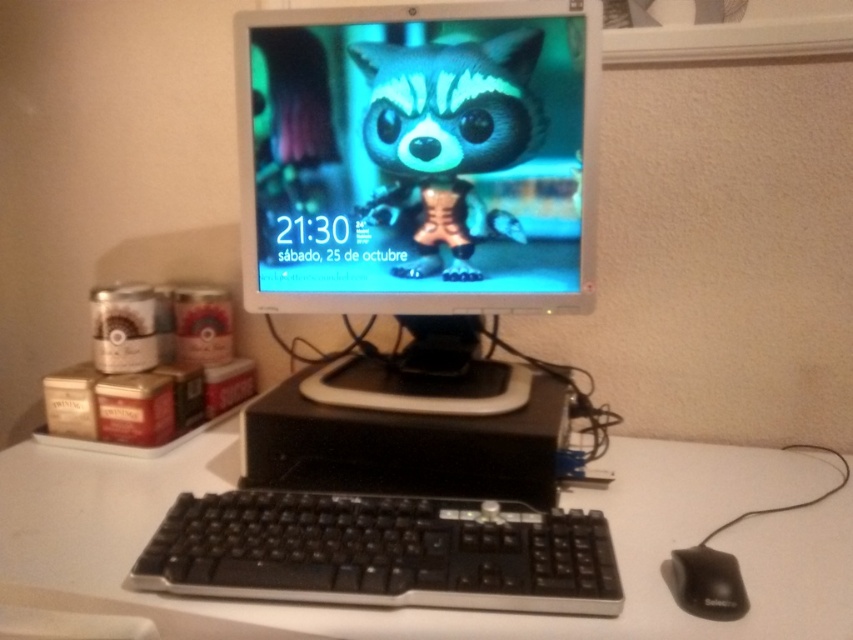
Is black plastic keyboard at center shorter than black matte mouse at lower right?

No.

Which is more to the right, black plastic keyboard at center or black matte mouse at lower right?

black matte mouse at lower right is more to the right.

Image resolution: width=853 pixels, height=640 pixels. What do you see at coordinates (381, 552) in the screenshot?
I see `black plastic keyboard at center` at bounding box center [381, 552].

What are the coordinates of `black plastic keyboard at center` in the screenshot? It's located at (381, 552).

Describe the element at coordinates (434, 609) in the screenshot. I see `white matte table at center` at that location.

Can you confirm if white matte table at center is taller than black plastic keyboard at center?

Yes.

What are the coordinates of `white matte table at center` in the screenshot? It's located at pyautogui.click(x=434, y=609).

Looking at this image, does satin silver monitor at center appear on the left side of black matte mouse at lower right?

Yes, satin silver monitor at center is to the left of black matte mouse at lower right.

Is point (367, 292) positioned before point (706, 582)?

No, it is not.

Is point (316, 218) less distant than point (706, 598)?

That is False.

This screenshot has height=640, width=853. In order to click on satin silver monitor at center in this screenshot , I will do `click(416, 156)`.